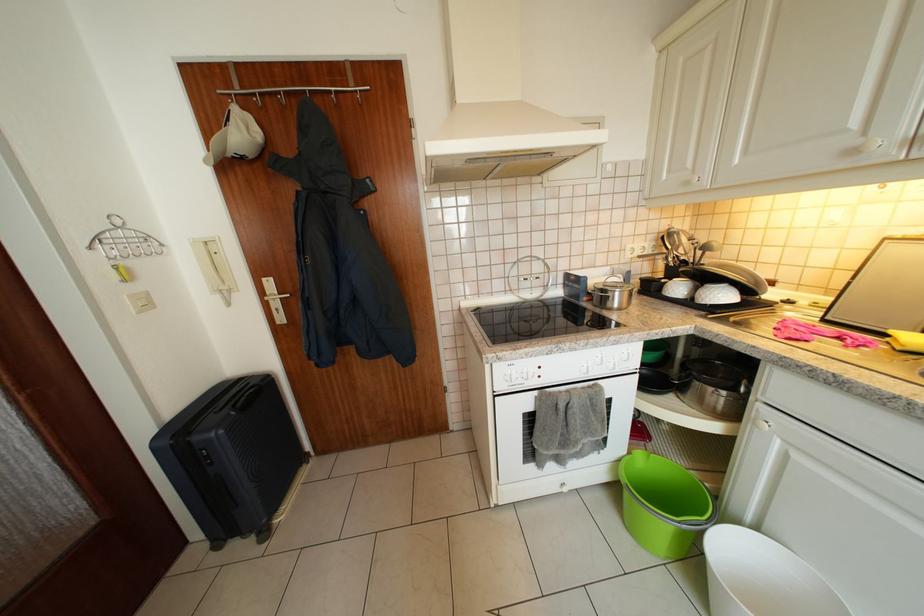
What do you see at coordinates (665, 487) in the screenshot? I see `a green bucket handle` at bounding box center [665, 487].